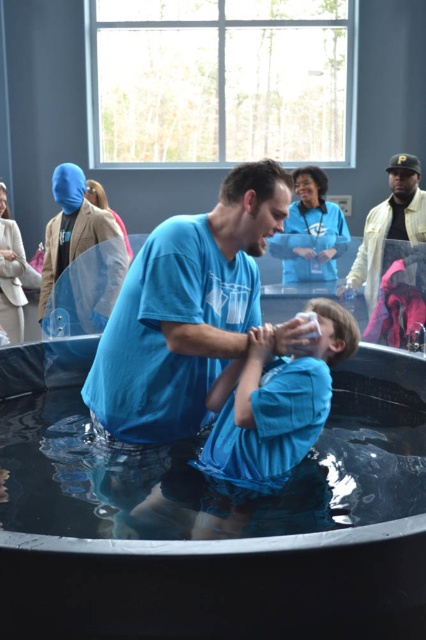
Question: Does matte blue shirt at center have a greater width compared to yellow leather jacket at upper right?

Choices:
 (A) yes
 (B) no

Answer: (B)

Question: Does blue cotton shirt at center lie behind blue matte mask at upper left?

Choices:
 (A) yes
 (B) no

Answer: (B)

Question: Which of the following is the closest to the observer?

Choices:
 (A) (72, 328)
 (B) (213, 484)
 (C) (242, 520)
 (D) (126, 404)

Answer: (C)

Question: Which point is farther from the camera taking this photo?

Choices:
 (A) (95, 259)
 (B) (224, 452)

Answer: (A)

Question: Does blue plastic tub at center have a lesser width compared to blue cotton shirt at center?

Choices:
 (A) yes
 (B) no

Answer: (B)

Question: Which object is farther from the camera taking this photo?

Choices:
 (A) blue matte mask at upper left
 (B) yellow leather jacket at upper right
 (C) matte blue shirt at center

Answer: (B)